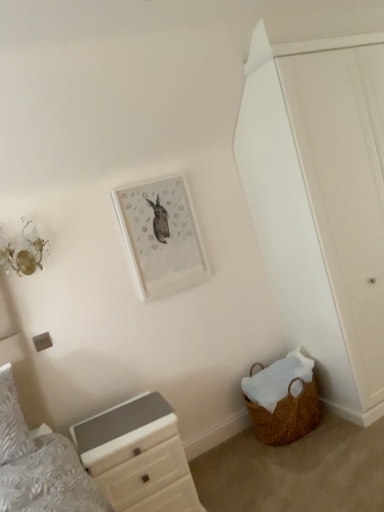
Question: From the image's perspective, is white glossy chest of drawers at lower left over white matte door at right?

Choices:
 (A) no
 (B) yes

Answer: (A)

Question: Does white glossy chest of drawers at lower left have a greater height compared to white matte door at right?

Choices:
 (A) yes
 (B) no

Answer: (B)

Question: Is white glossy chest of drawers at lower left far away from white matte door at right?

Choices:
 (A) yes
 (B) no

Answer: (A)

Question: From the image's perspective, is white glossy chest of drawers at lower left located beneath white matte door at right?

Choices:
 (A) no
 (B) yes

Answer: (B)

Question: Considering the relative sizes of white glossy chest of drawers at lower left and white matte door at right in the image provided, is white glossy chest of drawers at lower left thinner than white matte door at right?

Choices:
 (A) no
 (B) yes

Answer: (B)

Question: Does white glossy chest of drawers at lower left lie in front of white matte door at right?

Choices:
 (A) yes
 (B) no

Answer: (A)

Question: Does white matte door at right lie in front of white textured pillow at left?

Choices:
 (A) yes
 (B) no

Answer: (B)

Question: Considering the relative sizes of white matte door at right and white textured pillow at left in the image provided, is white matte door at right thinner than white textured pillow at left?

Choices:
 (A) yes
 (B) no

Answer: (B)

Question: From a real-world perspective, is white matte door at right located higher than white textured pillow at left?

Choices:
 (A) no
 (B) yes

Answer: (B)

Question: Is white matte door at right bigger than white textured pillow at left?

Choices:
 (A) no
 (B) yes

Answer: (B)

Question: Considering the relative sizes of white matte door at right and white textured pillow at left in the image provided, is white matte door at right wider than white textured pillow at left?

Choices:
 (A) no
 (B) yes

Answer: (B)

Question: Does white matte door at right have a lesser height compared to white textured pillow at left?

Choices:
 (A) yes
 (B) no

Answer: (B)

Question: From the image's perspective, does brown woven basket at lower right appear higher than matte white picture frame at upper center?

Choices:
 (A) no
 (B) yes

Answer: (A)